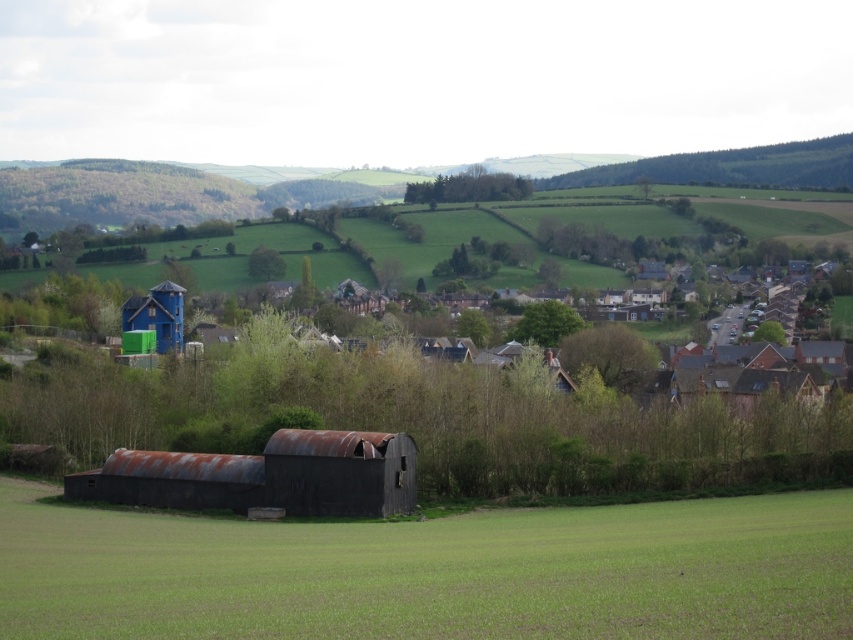
In the scene shown: Between rusty metal hut at center and blue painted wood hut at upper left, which one appears on the right side from the viewer's perspective?

From the viewer's perspective, rusty metal hut at center appears more on the right side.

Is point (289, 484) positioned in front of point (136, 296)?

Yes, it is.

The height and width of the screenshot is (640, 853). What do you see at coordinates (339, 472) in the screenshot?
I see `rusty metal hut at center` at bounding box center [339, 472].

The height and width of the screenshot is (640, 853). Find the location of `rusty metal hut at center`. rusty metal hut at center is located at coordinates (339, 472).

Is blue wooden house at upper left wider than blue painted wood hut at upper left?

Indeed, blue wooden house at upper left has a greater width compared to blue painted wood hut at upper left.

Is blue wooden house at upper left to the right of blue painted wood hut at upper left from the viewer's perspective?

Yes, blue wooden house at upper left is to the right of blue painted wood hut at upper left.

Locate an element on the screen. The width and height of the screenshot is (853, 640). blue wooden house at upper left is located at coordinates (363, 388).

Does green grassy field at lower center have a lesser width compared to blue wooden house at upper left?

Indeed, green grassy field at lower center has a lesser width compared to blue wooden house at upper left.

Is green grassy field at lower center taller than blue wooden house at upper left?

No.

Between point (74, 509) and point (822, 422), which one is positioned in front?

Positioned in front is point (74, 509).

Find the location of a particular element. The height and width of the screenshot is (640, 853). green grassy field at lower center is located at coordinates (431, 572).